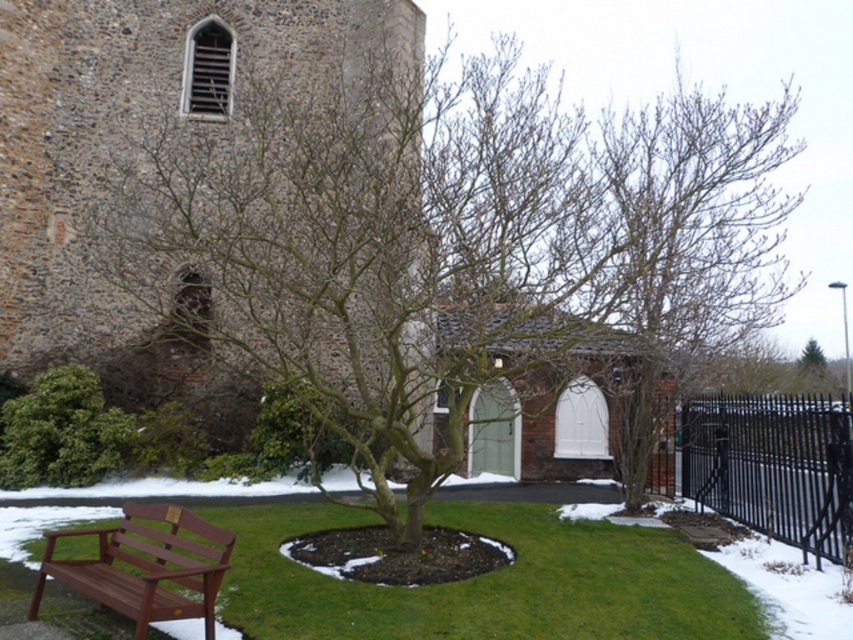
Between green grass at lower left and black wrought iron fence at lower right, which one is positioned lower?

green grass at lower left is below.

Measure the distance between point (257, 612) and camera.

Point (257, 612) and camera are 5.61 meters apart from each other.

At what (x,y) coordinates should I click in order to perform the action: click on green grass at lower left. Please return your answer as a coordinate pair (x, y). The image size is (853, 640). Looking at the image, I should click on (485, 580).

Who is lower down, black wrought iron fence at lower right or mahogany wood bench at lower left?

Positioned lower is mahogany wood bench at lower left.

Is black wrought iron fence at lower right behind mahogany wood bench at lower left?

Yes, black wrought iron fence at lower right is behind mahogany wood bench at lower left.

Between point (804, 515) and point (102, 545), which one is positioned in front?

Point (102, 545) is more forward.

Identify the location of black wrought iron fence at lower right. The height and width of the screenshot is (640, 853). (773, 465).

Can you confirm if brown stone church at upper left is positioned below mahogany wood bench at lower left?

No.

Is point (374, 40) farther from camera compared to point (140, 620)?

Yes, it is behind point (140, 620).

Identify the location of brown stone church at upper left. Image resolution: width=853 pixels, height=640 pixels. (131, 129).